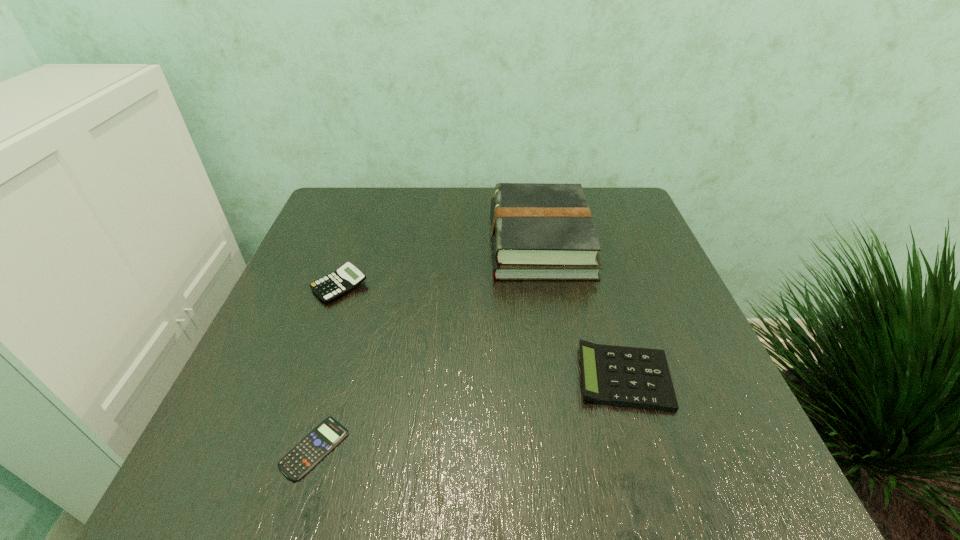
Where is `free space at the left edge`? This screenshot has width=960, height=540. free space at the left edge is located at coordinates (285, 335).

I want to click on free region at the right edge, so click(x=677, y=313).

Locate an element on the screen. Image resolution: width=960 pixels, height=540 pixels. vacant space at the far left corner of the desktop is located at coordinates (334, 226).

Find the location of `free space at the near left corner`. free space at the near left corner is located at coordinates (274, 469).

You are a GUI agent. You are given a task and a screenshot of the screen. Output one action in this format:
    pyautogui.click(x=<x>, y=<y>)
    Task: Click on the free space at the far right corner of the desktop
    This screenshot has height=540, width=960.
    Given the screenshot: What is the action you would take?
    pyautogui.click(x=624, y=199)

You are a GUI agent. You are given a task and a screenshot of the screen. Output one action in this format:
    pyautogui.click(x=<x>, y=<y>)
    Task: Click on the vacant space at the near right corner of the desktop
    The width and height of the screenshot is (960, 540).
    Given the screenshot: What is the action you would take?
    pyautogui.click(x=756, y=480)

Where is `vacant space that's between the shortest object and the second nearest object`? Image resolution: width=960 pixels, height=540 pixels. vacant space that's between the shortest object and the second nearest object is located at coordinates (469, 413).

Locate an element on the screen. The image size is (960, 540). vacant area that lies between the second farthest calculator and the shortest object is located at coordinates (469, 413).

You are a GUI agent. You are given a task and a screenshot of the screen. Output one action in this format:
    pyautogui.click(x=<x>, y=<y>)
    Task: Click on the vacant space in between the second nearest calculator and the tallest object
    The width and height of the screenshot is (960, 540).
    Given the screenshot: What is the action you would take?
    pyautogui.click(x=582, y=309)

You are a GUI agent. You are given a task and a screenshot of the screen. Output one action in this format:
    pyautogui.click(x=<x>, y=<y>)
    Task: Click on the free space between the farthest calculator and the second farthest calculator
    This screenshot has height=540, width=960.
    Given the screenshot: What is the action you would take?
    pyautogui.click(x=482, y=332)